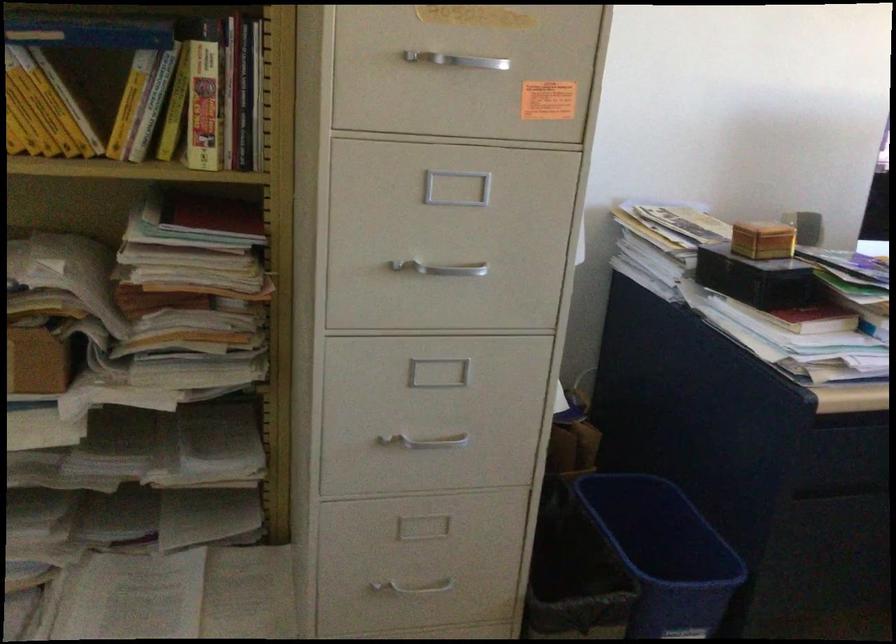
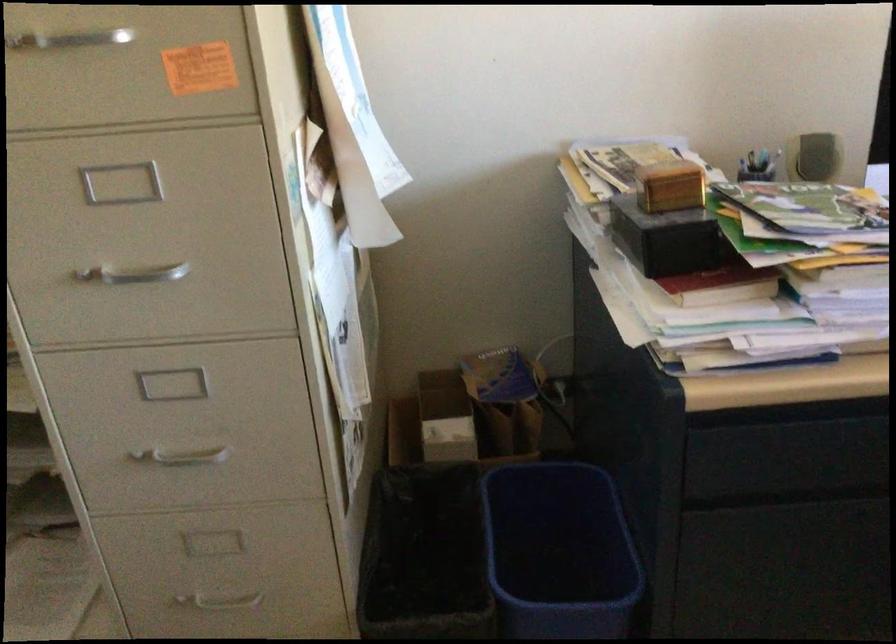
In the second image, find the point that corresponds to (x=778, y=277) in the first image.

(668, 239)